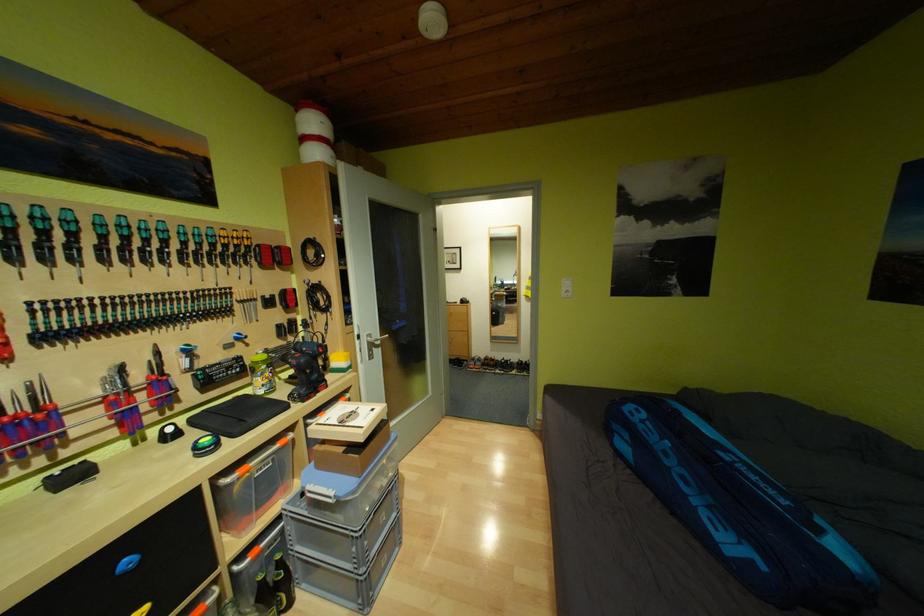
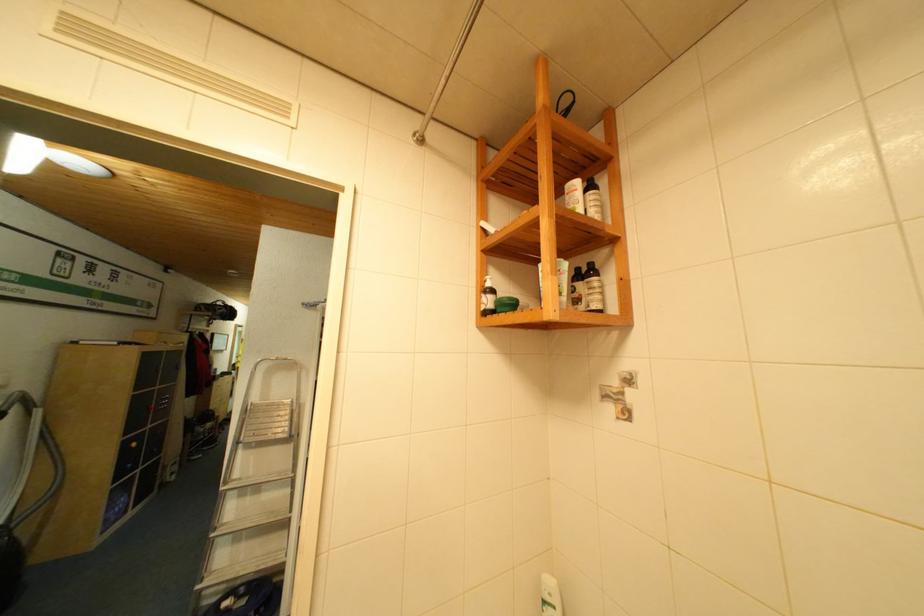
Question: I am providing you with two images of the same scene from different viewpoints. Which of the following objects are not visible in image2?

Choices:
 (A) white pump bottle
 (B) green glass bottle
 (C) blue cart handle
 (D) metal wall fixture

Answer: (B)